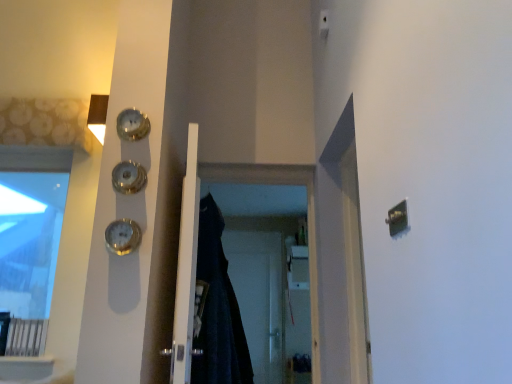
What is the approximate width of metallic glass clock at upper left, marked as the 3th clock in a bottom-to-top arrangement?

It is 6.32 centimeters.

Identify the location of black fabric screen door at center, which appears as the second screen door when viewed from the back. (308, 219).

What do you see at coordinates (218, 309) in the screenshot?
I see `dark fabric robe at center` at bounding box center [218, 309].

What do you see at coordinates (128, 177) in the screenshot? I see `shiny gold clock at upper left, the second clock when ordered from top to bottom` at bounding box center [128, 177].

Measure the distance between white matte door at center and camera.

A distance of 1.68 meters exists between white matte door at center and camera.

At what (x,y) coordinates should I click in order to perform the action: click on transparent glass window at upper left. Please return your answer as a coordinate pair (x, y). The width and height of the screenshot is (512, 384). Looking at the image, I should click on (35, 158).

Who is taller, dark fabric robe at center or gold metallic clock at left, which ranks as the 3th clock in top-to-bottom order?

dark fabric robe at center.

From a real-world perspective, does dark fabric robe at center sit lower than gold metallic clock at left, which ranks as the 3th clock in top-to-bottom order?

Yes.

Is dark fabric robe at center positioned with its back to gold metallic clock at left, which ranks as the 3th clock in top-to-bottom order?

That's not correct — dark fabric robe at center is not looking away from gold metallic clock at left, which ranks as the 3th clock in top-to-bottom order.

How far apart are dark fabric robe at center and gold metallic clock at left, which ranks as the 3th clock in top-to-bottom order?

The distance of dark fabric robe at center from gold metallic clock at left, which ranks as the 3th clock in top-to-bottom order, is 19.32 inches.

Based on their positions, is transparent glass window at upper left located to the left or right of white plastic light switch at upper center?

Based on their positions, transparent glass window at upper left is located to the left of white plastic light switch at upper center.

Is point (73, 363) behind point (321, 11)?

No, it is in front of (321, 11).

The width and height of the screenshot is (512, 384). In order to click on light switch on the right of transparent glass window at upper left in this screenshot , I will do `click(324, 23)`.

Is transparent glass window at upper left not within white plastic light switch at upper center?

Yes, transparent glass window at upper left is located beyond the bounds of white plastic light switch at upper center.

Which is more distant, (x=115, y=189) or (x=125, y=137)?

Point (x=125, y=137)

Considering the relative positions of shiny gold clock at upper left, which is the 2th clock in bottom-to-top order, and metallic glass clock at upper left, marked as the 3th clock in a bottom-to-top arrangement, in the image provided, is shiny gold clock at upper left, which is the 2th clock in bottom-to-top order, in front of metallic glass clock at upper left, marked as the 3th clock in a bottom-to-top arrangement,?

Yes, it is in front of metallic glass clock at upper left, marked as the 3th clock in a bottom-to-top arrangement.

Between shiny gold clock at upper left, the second clock when ordered from top to bottom, and metallic glass clock at upper left, marked as the 3th clock in a bottom-to-top arrangement, which one has smaller size?

With smaller size is metallic glass clock at upper left, marked as the 3th clock in a bottom-to-top arrangement.

Looking at their sizes, would you say shiny gold clock at upper left, which is the 2th clock in bottom-to-top order, is wider or thinner than metallic glass clock at upper left, marked as the 3th clock in a bottom-to-top arrangement?

Considering their sizes, shiny gold clock at upper left, which is the 2th clock in bottom-to-top order, looks broader than metallic glass clock at upper left, marked as the 3th clock in a bottom-to-top arrangement.

From the image's perspective, does transparent glass window at upper left appear lower than metallic glass clock at upper left, which ranks as the first clock in top-to-bottom order?

Yes, from the image's perspective, transparent glass window at upper left is beneath metallic glass clock at upper left, which ranks as the first clock in top-to-bottom order.

From a real-world perspective, is transparent glass window at upper left below metallic glass clock at upper left, which ranks as the first clock in top-to-bottom order?

Yes.

Is transparent glass window at upper left looking in the opposite direction of metallic glass clock at upper left, which ranks as the first clock in top-to-bottom order?

No, transparent glass window at upper left is not facing away from metallic glass clock at upper left, which ranks as the first clock in top-to-bottom order.

Is transparent glass window at upper left not near metallic glass clock at upper left, which ranks as the first clock in top-to-bottom order?

Yes, transparent glass window at upper left and metallic glass clock at upper left, which ranks as the first clock in top-to-bottom order, are located far from each other.

Considering the relative positions of black fabric screen door at center, which appears as the second screen door when viewed from the back, and dark fabric robe at center in the image provided, is black fabric screen door at center, which appears as the second screen door when viewed from the back, to the left or to the right of dark fabric robe at center?

Based on their positions, black fabric screen door at center, which appears as the second screen door when viewed from the back, is located to the right of dark fabric robe at center.

How different are the orientations of black fabric screen door at center, which appears as the second screen door when viewed from the back, and dark fabric robe at center in degrees?

There is a 95.6-degree angle between the facing directions of black fabric screen door at center, which appears as the second screen door when viewed from the back, and dark fabric robe at center.

Is black fabric screen door at center, arranged as the 1th screen door when viewed from the front, facing towards dark fabric robe at center?

Yes, black fabric screen door at center, arranged as the 1th screen door when viewed from the front, faces towards dark fabric robe at center.

Can you confirm if black fabric screen door at center, which appears as the second screen door when viewed from the back, is thinner than dark fabric robe at center?

Correct, the width of black fabric screen door at center, which appears as the second screen door when viewed from the back, is less than that of dark fabric robe at center.

From a real-world perspective, is gold metallic clock at left, which is the first clock in bottom-to-top order, positioned above or below transparent plastic screen door at center, placed as the 1th screen door when sorted from back to front?

From a real-world perspective, gold metallic clock at left, which is the first clock in bottom-to-top order, is physically above transparent plastic screen door at center, placed as the 1th screen door when sorted from back to front.

Is gold metallic clock at left, which ranks as the 3th clock in top-to-bottom order, aimed at transparent plastic screen door at center, which is counted as the second screen door, starting from the front?

No, gold metallic clock at left, which ranks as the 3th clock in top-to-bottom order, is not oriented towards transparent plastic screen door at center, which is counted as the second screen door, starting from the front.

Is gold metallic clock at left, which is the first clock in bottom-to-top order, surrounding transparent plastic screen door at center, which is counted as the second screen door, starting from the front?

No, transparent plastic screen door at center, which is counted as the second screen door, starting from the front, is not inside gold metallic clock at left, which is the first clock in bottom-to-top order.

From the image's perspective, is shiny gold clock at upper left, which is the 2th clock in bottom-to-top order, beneath transparent plastic screen door at center, placed as the 1th screen door when sorted from back to front?

Incorrect, from the image's perspective, shiny gold clock at upper left, which is the 2th clock in bottom-to-top order, is higher than transparent plastic screen door at center, placed as the 1th screen door when sorted from back to front.

Considering the relative positions of shiny gold clock at upper left, the second clock when ordered from top to bottom, and transparent plastic screen door at center, which is counted as the second screen door, starting from the front, in the image provided, is shiny gold clock at upper left, the second clock when ordered from top to bottom, to the right of transparent plastic screen door at center, which is counted as the second screen door, starting from the front, from the viewer's perspective?

No, shiny gold clock at upper left, the second clock when ordered from top to bottom, is not to the right of transparent plastic screen door at center, which is counted as the second screen door, starting from the front.

Which of these two, shiny gold clock at upper left, which is the 2th clock in bottom-to-top order, or transparent plastic screen door at center, placed as the 1th screen door when sorted from back to front, is bigger?

Bigger between the two is transparent plastic screen door at center, placed as the 1th screen door when sorted from back to front.

Is shiny gold clock at upper left, the second clock when ordered from top to bottom, wider or thinner than transparent plastic screen door at center, placed as the 1th screen door when sorted from back to front?

Clearly, shiny gold clock at upper left, the second clock when ordered from top to bottom, has more width compared to transparent plastic screen door at center, placed as the 1th screen door when sorted from back to front.

Where is `the 1st clock above the dark fabric robe at center (from the image's perspective)`? The image size is (512, 384). the 1st clock above the dark fabric robe at center (from the image's perspective) is located at coordinates (123, 236).

You are a GUI agent. You are given a task and a screenshot of the screen. Output one action in this format:
    pyautogui.click(x=<x>, y=<y>)
    Task: Click on the light switch above the transparent glass window at upper left (from a real-world perspective)
    This screenshot has width=512, height=384.
    Given the screenshot: What is the action you would take?
    pyautogui.click(x=324, y=23)

Which object lies nearer to the anchor point white plastic light switch at upper center, black fabric screen door at center, arranged as the 1th screen door when viewed from the front, or dark fabric robe at center?

Based on the image, black fabric screen door at center, arranged as the 1th screen door when viewed from the front, appears to be nearer to white plastic light switch at upper center.

From the image, which object appears to be nearer to metallic glass clock at upper left, which ranks as the first clock in top-to-bottom order, transparent plastic screen door at center, which is counted as the second screen door, starting from the front, or gold metallic clock at left, which is the first clock in bottom-to-top order?

Among the two, gold metallic clock at left, which is the first clock in bottom-to-top order, is located nearer to metallic glass clock at upper left, which ranks as the first clock in top-to-bottom order.

Considering their positions, is transparent plastic screen door at center, placed as the 1th screen door when sorted from back to front, positioned closer to transparent glass window at upper left than shiny gold clock at upper left, which is the 2th clock in bottom-to-top order?

shiny gold clock at upper left, which is the 2th clock in bottom-to-top order, is positioned closer to the anchor transparent glass window at upper left.

Estimate the real-world distances between objects in this image. Which object is further from transparent plastic screen door at center, which is counted as the second screen door, starting from the front, white matte door at center or black fabric screen door at center, which appears as the second screen door when viewed from the back?

white matte door at center is positioned further to the anchor transparent plastic screen door at center, which is counted as the second screen door, starting from the front.

Looking at the image, which one is located further to shiny gold clock at upper left, which is the 2th clock in bottom-to-top order, metallic glass clock at upper left, marked as the 3th clock in a bottom-to-top arrangement, or gold metallic clock at left, which is the first clock in bottom-to-top order?

gold metallic clock at left, which is the first clock in bottom-to-top order, is further to shiny gold clock at upper left, which is the 2th clock in bottom-to-top order.

When comparing their distances from transparent plastic screen door at center, placed as the 1th screen door when sorted from back to front, does gold metallic clock at left, which ranks as the 3th clock in top-to-bottom order, or white plastic light switch at upper center seem closer?

white plastic light switch at upper center.

From the image, which object appears to be farther from dark fabric robe at center, white matte door at center or transparent plastic screen door at center, which is counted as the second screen door, starting from the front?

transparent plastic screen door at center, which is counted as the second screen door, starting from the front, is further to dark fabric robe at center.

When comparing their distances from shiny gold clock at upper left, which is the 2th clock in bottom-to-top order, does transparent glass window at upper left or gold metallic clock at left, which is the first clock in bottom-to-top order, seem further?

Among the two, transparent glass window at upper left is located further to shiny gold clock at upper left, which is the 2th clock in bottom-to-top order.

Find the location of a particular element. robe between transparent glass window at upper left and white plastic light switch at upper center is located at coordinates (218, 309).

The image size is (512, 384). I want to click on robe between gold metallic clock at left, which ranks as the 3th clock in top-to-bottom order, and black fabric screen door at center, which appears as the second screen door when viewed from the back, along the z-axis, so click(218, 309).

Locate an element on the screen. Image resolution: width=512 pixels, height=384 pixels. robe between metallic glass clock at upper left, marked as the 3th clock in a bottom-to-top arrangement, and black fabric screen door at center, arranged as the 1th screen door when viewed from the front, vertically is located at coordinates (218, 309).

Image resolution: width=512 pixels, height=384 pixels. What are the coordinates of `robe between white plastic light switch at upper center and black fabric screen door at center, arranged as the 1th screen door when viewed from the front, in the up-down direction` in the screenshot? It's located at (218, 309).